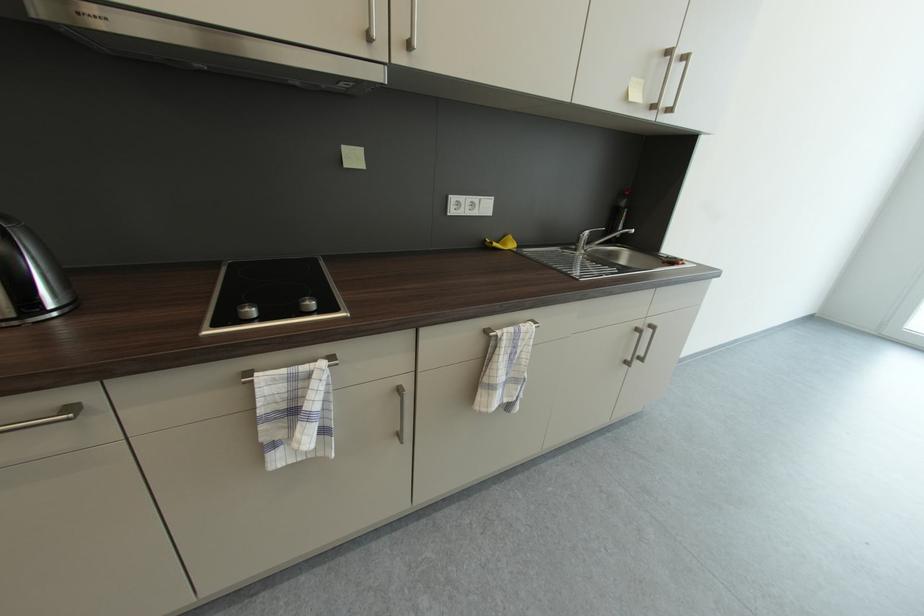
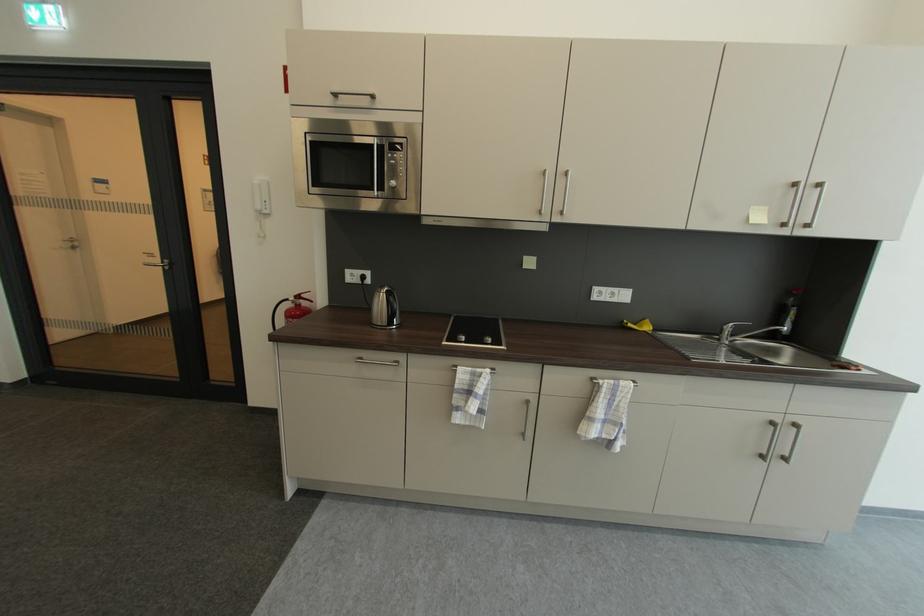
The point at (235, 318) is marked in the first image. Where is the corresponding point in the second image?

(458, 341)